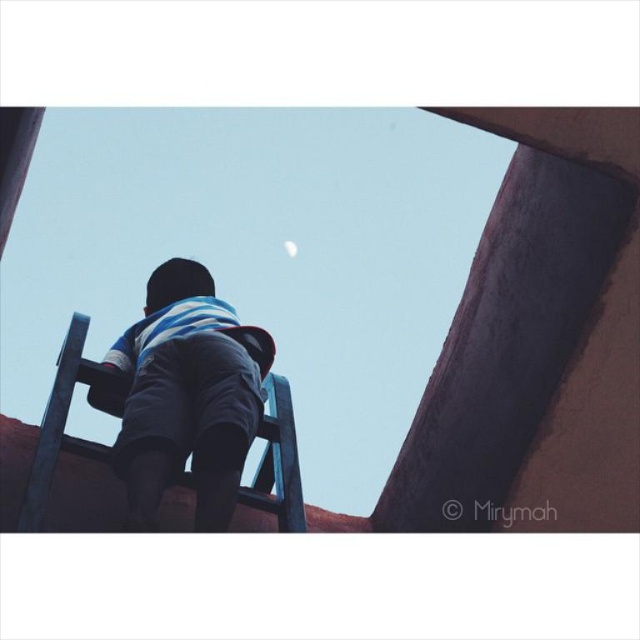
You are a photographer trying to capture the child in the blue striped shirt at center and the white glossy moon at upper center in the same frame. Based on their sizes in the image, which one would you need to zoom in more to focus on?

The blue striped shirt at center has a lesser width compared to the white glossy moon at upper center, so you would need to zoom in more to focus on the blue striped shirt at center to make it appear larger in the frame.

You are a photographer trying to capture the child in the blue striped shirt at center. The camera is positioned at point A, which is at coordinates 0.5, 0.5. To ensure the child is in focus, you need to adjust the camera to point directly at the child. What direction should you move the camera horizontally and vertically to align it with the child?

The blue striped shirt at center is located at coordinates (188, 394). Since the camera is at (320, 320), you should move the camera 0.117 units to the right and 0.206 units downward to align it with the child.